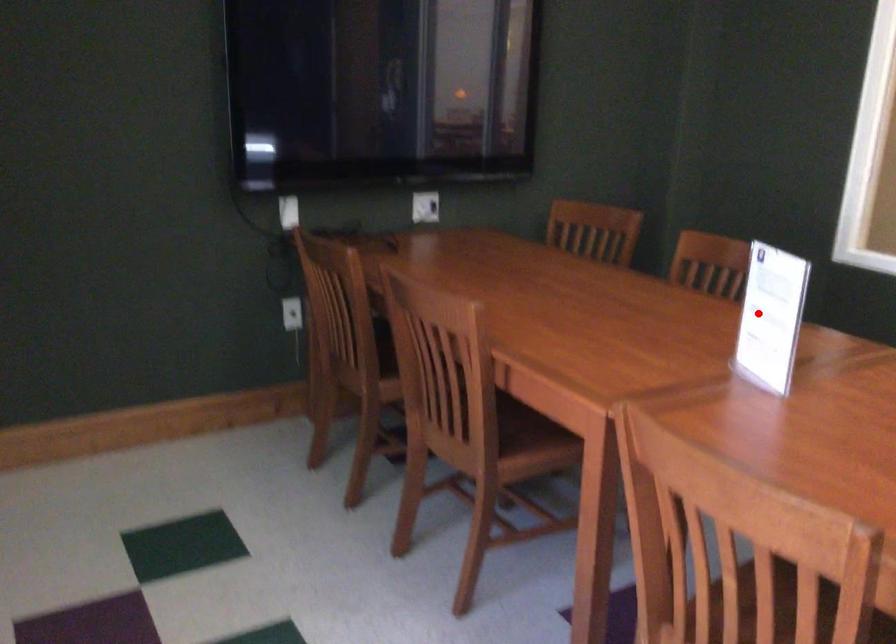
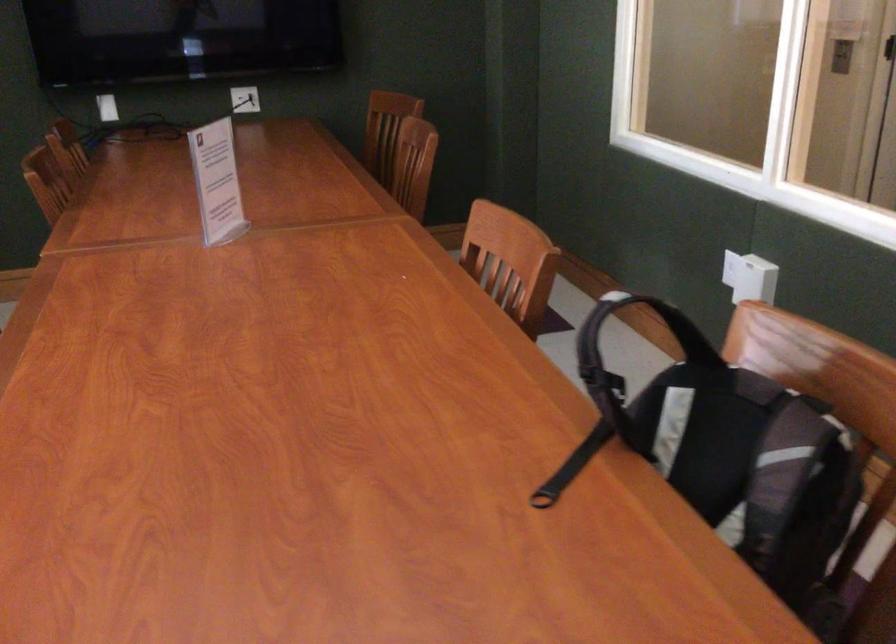
Question: I am providing you with two images of the same scene from different viewpoints. Image1 has a red point marked. In image2, the corresponding 3D location appears at what relative position? Reply with the corresponding letter.

Choices:
 (A) Closer
 (B) Farther

Answer: (B)